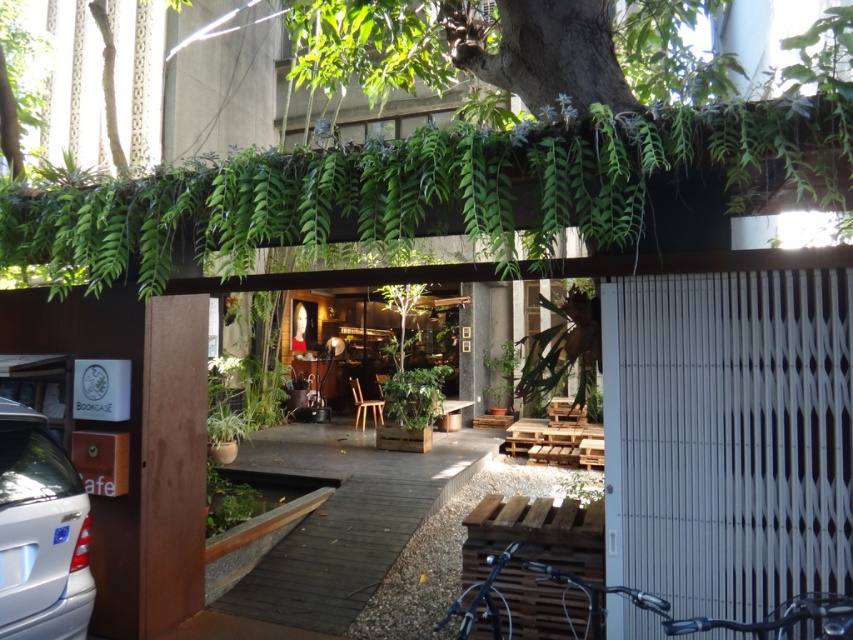
The image size is (853, 640). I want to click on silver metallic car at lower left, so click(39, 532).

Does silver metallic car at lower left have a lesser height compared to shiny metallic bicycle at lower right?

No, silver metallic car at lower left is not shorter than shiny metallic bicycle at lower right.

What do you see at coordinates (39, 532) in the screenshot? Image resolution: width=853 pixels, height=640 pixels. I see `silver metallic car at lower left` at bounding box center [39, 532].

The image size is (853, 640). In order to click on silver metallic car at lower left in this screenshot , I will do `click(39, 532)`.

Who is taller, silver metallic car at lower left or shiny black bicycle at lower center?

silver metallic car at lower left is taller.

Is point (68, 483) positioned in front of point (486, 586)?

No.

Where is `silver metallic car at lower left`? Image resolution: width=853 pixels, height=640 pixels. silver metallic car at lower left is located at coordinates (39, 532).

Which is in front, point (482, 564) or point (561, 570)?

Point (561, 570)

Can you confirm if shiny black bicycle at lower center is positioned to the right of shiny metallic bicycle at lower right?

No, shiny black bicycle at lower center is not to the right of shiny metallic bicycle at lower right.

Find the location of a particular element. The width and height of the screenshot is (853, 640). shiny black bicycle at lower center is located at coordinates (521, 589).